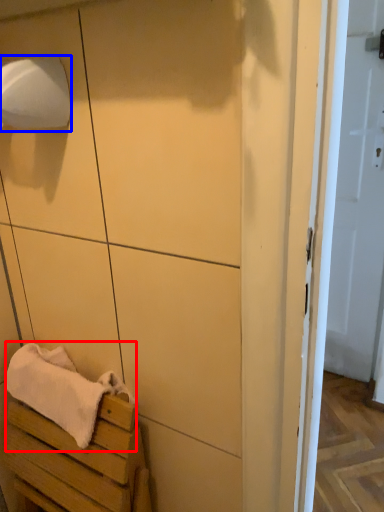
Question: Which of the following is the closest to the observer, bath towel (highlighted by a red box) or toilet paper (highlighted by a blue box)?

Choices:
 (A) bath towel
 (B) toilet paper

Answer: (B)